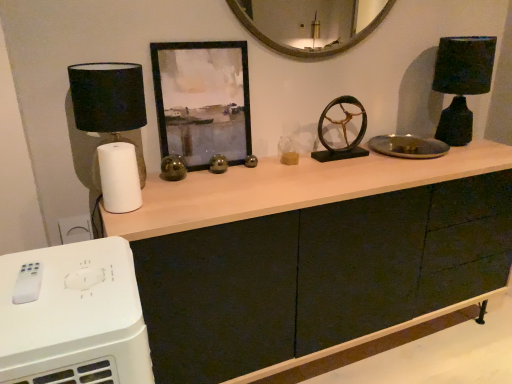
This screenshot has height=384, width=512. I want to click on vacant space to the right of bronze metallic wheel at center, so click(x=380, y=160).